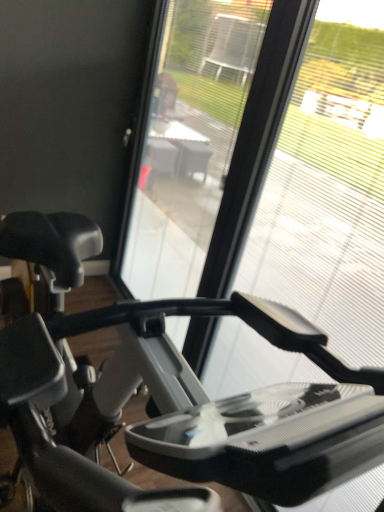
Question: Is transparent plastic glass at center outside of transparent plastic screen door at center?

Choices:
 (A) yes
 (B) no

Answer: (A)

Question: Is transparent plastic glass at center to the right of transparent plastic screen door at center from the viewer's perspective?

Choices:
 (A) no
 (B) yes

Answer: (B)

Question: Considering the relative sizes of transparent plastic glass at center and transparent plastic screen door at center in the image provided, is transparent plastic glass at center taller than transparent plastic screen door at center?

Choices:
 (A) yes
 (B) no

Answer: (B)

Question: From the image's perspective, is transparent plastic glass at center below transparent plastic screen door at center?

Choices:
 (A) no
 (B) yes

Answer: (B)

Question: Is transparent plastic glass at center wider than transparent plastic screen door at center?

Choices:
 (A) no
 (B) yes

Answer: (A)

Question: Would you say transparent plastic glass at center contains transparent plastic screen door at center?

Choices:
 (A) no
 (B) yes

Answer: (A)

Question: Is transparent plastic glass at center to the right of matte black stationary bicycle at left from the viewer's perspective?

Choices:
 (A) no
 (B) yes

Answer: (B)

Question: Is transparent plastic glass at center oriented towards matte black stationary bicycle at left?

Choices:
 (A) no
 (B) yes

Answer: (B)

Question: Is transparent plastic glass at center positioned in front of matte black stationary bicycle at left?

Choices:
 (A) no
 (B) yes

Answer: (A)

Question: Can you confirm if transparent plastic glass at center is taller than matte black stationary bicycle at left?

Choices:
 (A) no
 (B) yes

Answer: (B)

Question: Is transparent plastic glass at center bigger than matte black stationary bicycle at left?

Choices:
 (A) yes
 (B) no

Answer: (B)

Question: Does transparent plastic glass at center have a smaller size compared to matte black stationary bicycle at left?

Choices:
 (A) yes
 (B) no

Answer: (A)

Question: Is matte black stationary bicycle at left with transparent plastic glass at center?

Choices:
 (A) yes
 (B) no

Answer: (B)